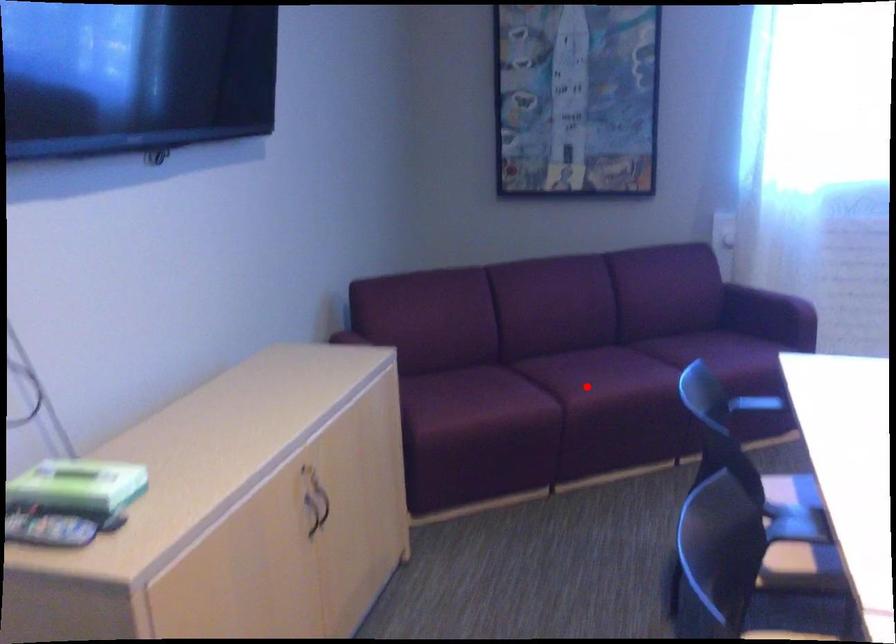
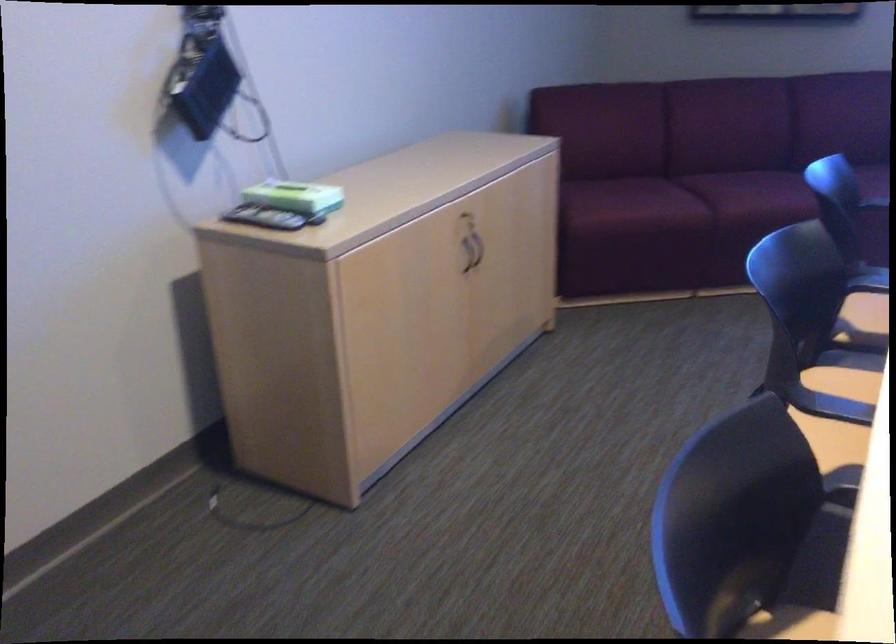
In the second image, find the point that corresponds to the highlighted location in the first image.

(745, 198)